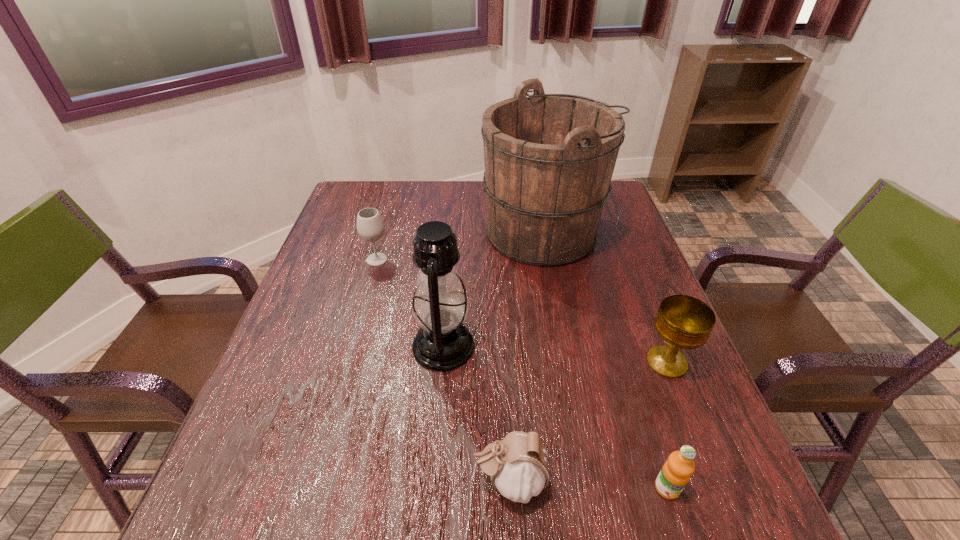
The image size is (960, 540). What are the coordinates of `vacant space that is in between the tallest object and the pouch` in the screenshot? It's located at [x=527, y=357].

You are a GUI agent. You are given a task and a screenshot of the screen. Output one action in this format:
    pyautogui.click(x=<x>, y=<y>)
    Task: Click on the vacant area between the chalice and the bucket
    Image resolution: width=960 pixels, height=540 pixels.
    Given the screenshot: What is the action you would take?
    pyautogui.click(x=606, y=298)

I want to click on unoccupied area between the pouch and the orange juice, so click(x=588, y=484).

Locate an element on the screen. Image resolution: width=960 pixels, height=540 pixels. vacant region between the orange juice and the tallest object is located at coordinates (606, 361).

Where is `free space between the fifth shortest object and the tallest object`? free space between the fifth shortest object and the tallest object is located at coordinates (494, 290).

Find the location of a particular element. free space between the leftmost object and the fifth shortest object is located at coordinates (410, 303).

Find the location of a particular element. free space between the leftmost object and the oil lamp is located at coordinates (410, 303).

Where is `free point between the fifth object from right to left and the pouch`? The image size is (960, 540). free point between the fifth object from right to left and the pouch is located at coordinates (476, 414).

The height and width of the screenshot is (540, 960). Identify the location of free space between the oil lamp and the leftmost object. pos(410,303).

The image size is (960, 540). What are the coordinates of `free area in between the chalice and the leftmost object` in the screenshot? It's located at (522, 311).